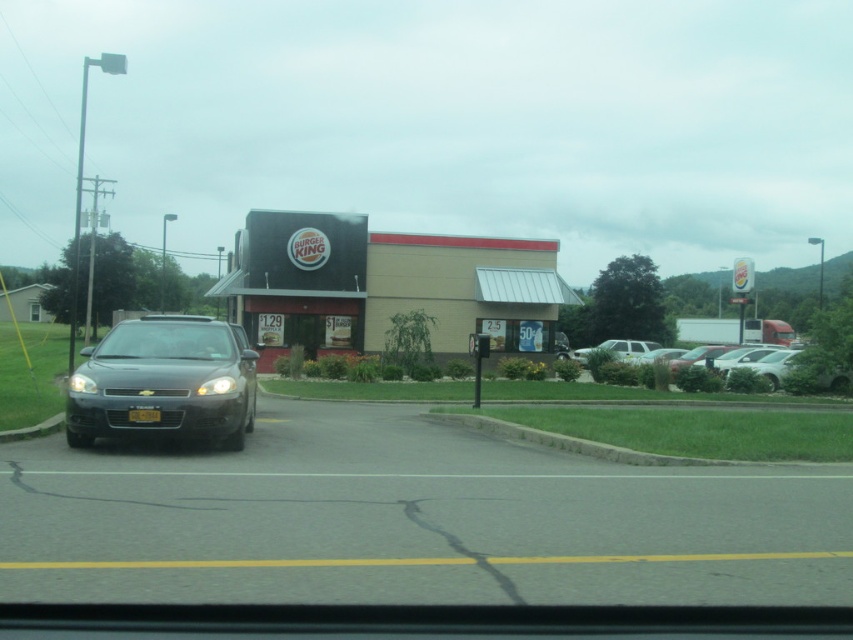
Question: Observing the image, what is the correct spatial positioning of matte black headlight at left in reference to yellow matte license plate at center?

Choices:
 (A) above
 (B) below

Answer: (A)

Question: Which object is the closest to the beige concrete burger king at center?

Choices:
 (A) yellow matte license plate at center
 (B) matte black headlight at left
 (C) matte black sedan at center

Answer: (C)

Question: Estimate the real-world distances between objects in this image. Which object is farther from the matte black headlight at lower left?

Choices:
 (A) yellow matte license plate at center
 (B) matte black sedan at center
 (C) beige concrete burger king at center

Answer: (C)

Question: Which point appears closest to the camera in this image?

Choices:
 (A) click(x=74, y=388)
 (B) click(x=140, y=413)

Answer: (B)

Question: Does beige concrete burger king at center appear under matte black sedan at center?

Choices:
 (A) no
 (B) yes

Answer: (A)

Question: Is matte black sedan at center smaller than silver metallic sedan at right?

Choices:
 (A) no
 (B) yes

Answer: (B)